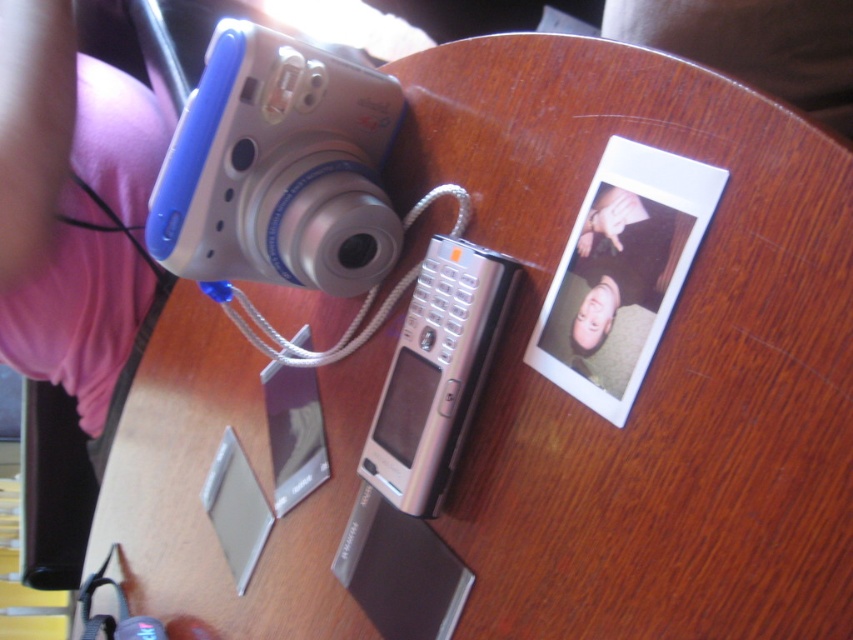
You are organizing items on a wooden table and need to place both the silver metallic phone at center and the matte silver phone at center. If you want to arrange them so that the larger one is to the left of the smaller one, which phone should be placed on the left side?

The silver metallic phone at center should be placed on the left side since it is larger than the matte silver phone at center.

You are sitting at the wooden table and want to pick up the blue plastic camera at upper left and the silver metallic phone at center. Which object will you need to reach further to grab?

The silver metallic phone at center is further away from you than the blue plastic camera at upper left, so you will need to reach further to grab the silver metallic phone at center.

You are standing at the edge of the table looking towards the center. There are two points marked on the table surface, point (293, 134) and point (576, 364). Which point is closer to you?

Point (576, 364) is closer to you because it is in front of point (293, 134).